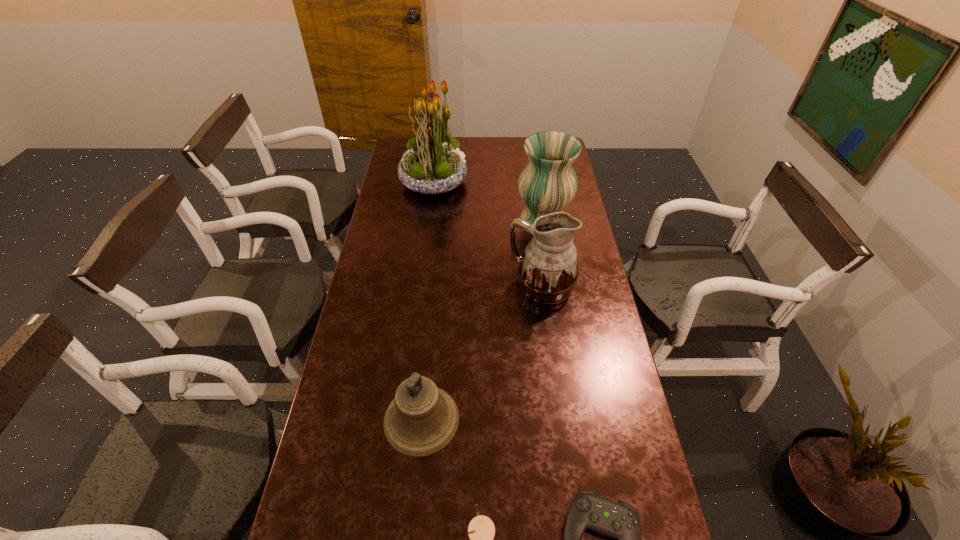
Find the location of a particular element. The width and height of the screenshot is (960, 540). free space located on the front of the bell is located at coordinates (416, 477).

In order to click on object situated at the far edge in this screenshot , I will do `click(433, 164)`.

Where is `flower arrangement that is at the left edge`? flower arrangement that is at the left edge is located at coordinates (433, 164).

Image resolution: width=960 pixels, height=540 pixels. I want to click on bell located in the left edge section of the desktop, so click(422, 419).

At what (x,y) coordinates should I click in order to perform the action: click on vase that is at the right edge. Please return your answer as a coordinate pair (x, y). The width and height of the screenshot is (960, 540). Looking at the image, I should click on (548, 183).

Locate an element on the screen. The image size is (960, 540). pitcher that is at the right edge is located at coordinates (548, 270).

Identify the location of object that is at the far left corner. This screenshot has width=960, height=540. (433, 164).

In the image, there is a desktop. Where is `vacant space at the far edge`? This screenshot has width=960, height=540. vacant space at the far edge is located at coordinates (513, 138).

Identify the location of free space at the left edge of the desktop. (345, 489).

Find the location of `blank space at the right edge`. blank space at the right edge is located at coordinates (615, 410).